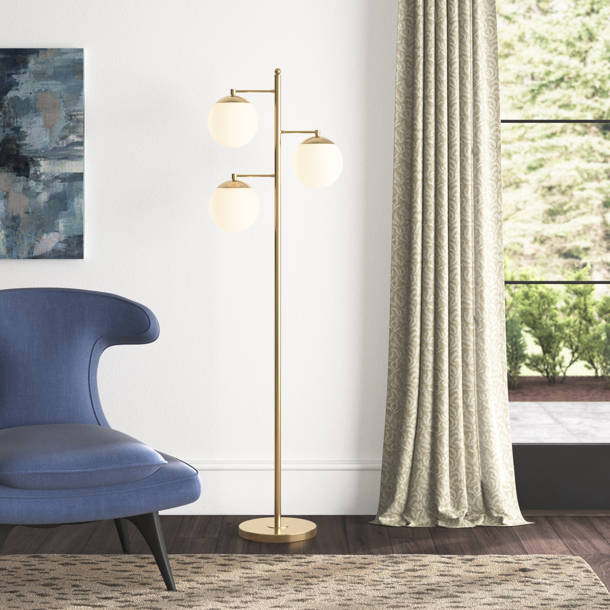
Identify the location of white wall. The width and height of the screenshot is (610, 610). (318, 363).